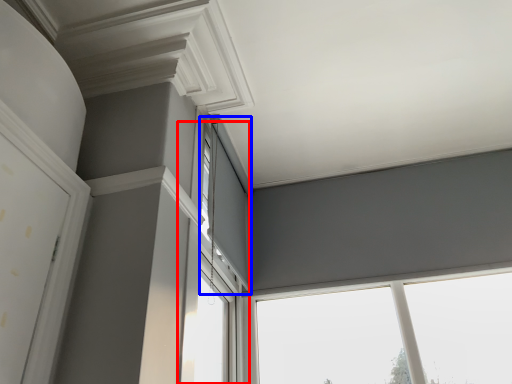
Question: Which point is closer to the camera, window (highlighted by a red box) or window (highlighted by a blue box)?

Choices:
 (A) window
 (B) window

Answer: (A)